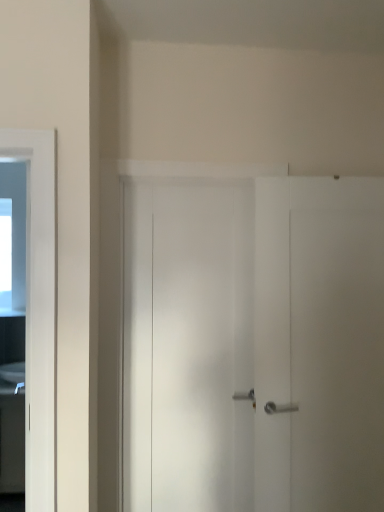
Question: Considering the relative positions of white glossy sink at left and black glossy cabinet at left in the image provided, is white glossy sink at left to the right of black glossy cabinet at left from the viewer's perspective?

Choices:
 (A) no
 (B) yes

Answer: (B)

Question: Are white glossy sink at left and black glossy cabinet at left far apart?

Choices:
 (A) no
 (B) yes

Answer: (A)

Question: From a real-world perspective, is white glossy sink at left on top of black glossy cabinet at left?

Choices:
 (A) no
 (B) yes

Answer: (B)

Question: Considering the relative positions of white glossy sink at left and black glossy cabinet at left in the image provided, is white glossy sink at left in front of black glossy cabinet at left?

Choices:
 (A) no
 (B) yes

Answer: (A)

Question: Can you confirm if white glossy sink at left is bigger than black glossy cabinet at left?

Choices:
 (A) no
 (B) yes

Answer: (A)

Question: Is the depth of white glossy sink at left greater than that of black glossy cabinet at left?

Choices:
 (A) yes
 (B) no

Answer: (A)

Question: Can you confirm if black glossy cabinet at left is positioned to the left of white glossy sink at left?

Choices:
 (A) no
 (B) yes

Answer: (B)

Question: Is black glossy cabinet at left closer to the viewer compared to white glossy sink at left?

Choices:
 (A) yes
 (B) no

Answer: (A)

Question: From the image's perspective, is black glossy cabinet at left beneath white glossy sink at left?

Choices:
 (A) yes
 (B) no

Answer: (A)

Question: Is black glossy cabinet at left to the right of white glossy sink at left from the viewer's perspective?

Choices:
 (A) no
 (B) yes

Answer: (A)

Question: Does black glossy cabinet at left turn towards white glossy sink at left?

Choices:
 (A) no
 (B) yes

Answer: (A)

Question: Are black glossy cabinet at left and white glossy sink at left far apart?

Choices:
 (A) yes
 (B) no

Answer: (B)

Question: From a real-world perspective, relative to black glossy cabinet at left, is white glossy sink at left vertically above or below?

Choices:
 (A) below
 (B) above

Answer: (B)